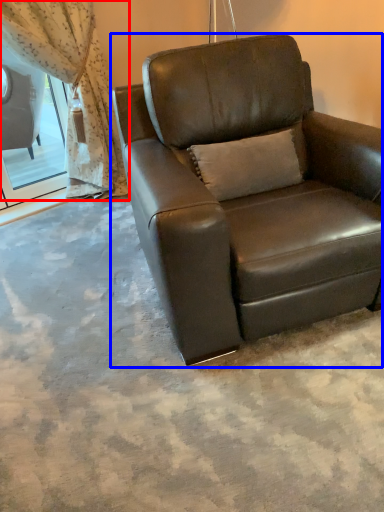
Question: Among these objects, which one is farthest to the camera, curtain (highlighted by a red box) or chair (highlighted by a blue box)?

Choices:
 (A) curtain
 (B) chair

Answer: (A)